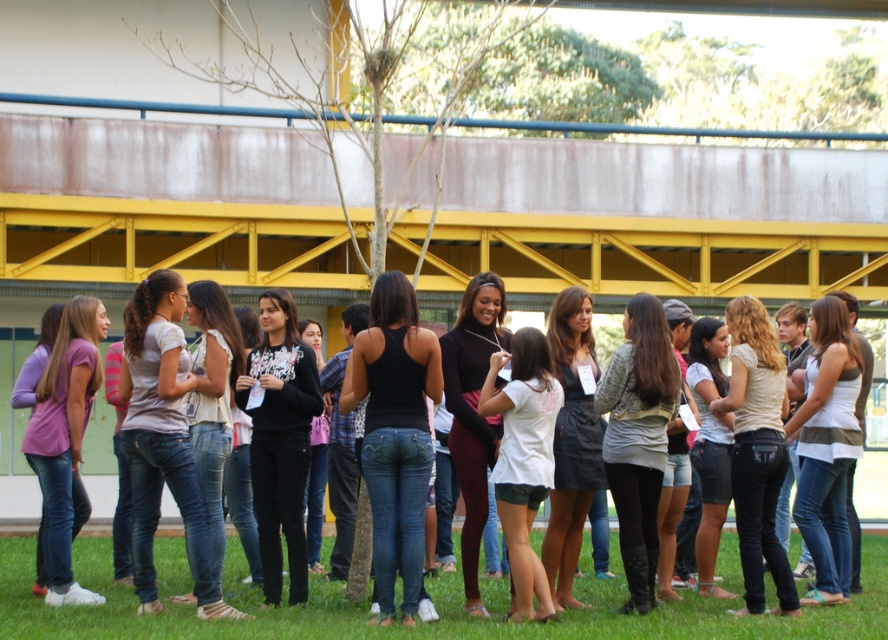
Does point (403, 630) lie behind point (749, 518)?

That is False.

Between green grass at lower center and matte white blouse at center, which one has less height?

Standing shorter between the two is green grass at lower center.

Identify the location of green grass at lower center. (418, 624).

Is black matte sweater at center closer to the viewer compared to matte pink shirt at lower left?

Yes, black matte sweater at center is in front of matte pink shirt at lower left.

Can you confirm if black matte sweater at center is positioned above matte pink shirt at lower left?

Correct, black matte sweater at center is located above matte pink shirt at lower left.

The height and width of the screenshot is (640, 888). Describe the element at coordinates (280, 440) in the screenshot. I see `black matte sweater at center` at that location.

Identify the location of black matte sweater at center. The height and width of the screenshot is (640, 888). (280, 440).

Can you confirm if black matte sweater at center is shorter than white matte shirt at center?

No, black matte sweater at center is not shorter than white matte shirt at center.

Between black matte sweater at center and white matte shirt at center, which one appears on the left side from the viewer's perspective?

black matte sweater at center

What do you see at coordinates (280, 440) in the screenshot?
I see `black matte sweater at center` at bounding box center [280, 440].

Where is `black matte sweater at center`? The height and width of the screenshot is (640, 888). black matte sweater at center is located at coordinates (280, 440).